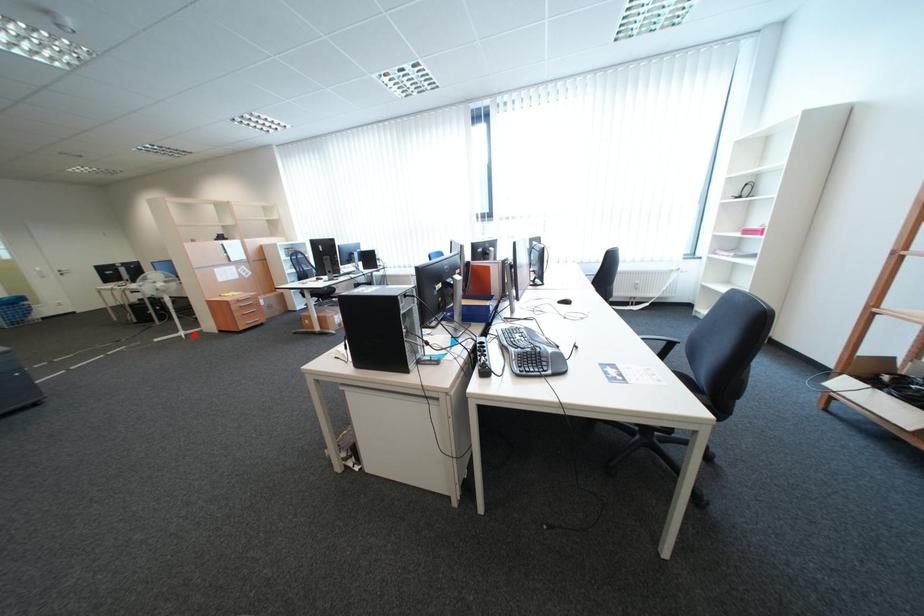
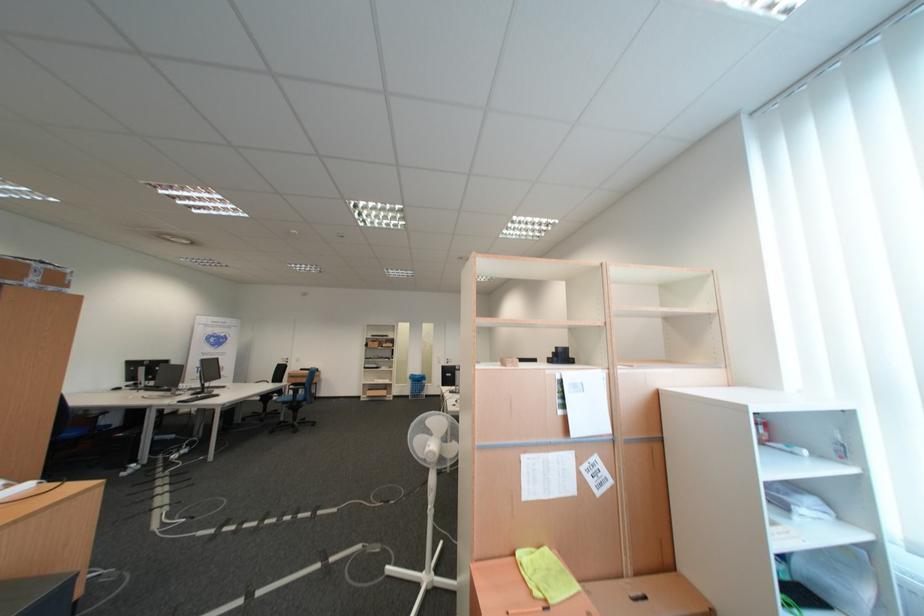
Question: I am providing you with two images of the same scene from different viewpoints. In image1, a red point is highlighted. Considering the same 3D point in image2, which of the following is correct?

Choices:
 (A) It is closer
 (B) It is farther

Answer: (B)